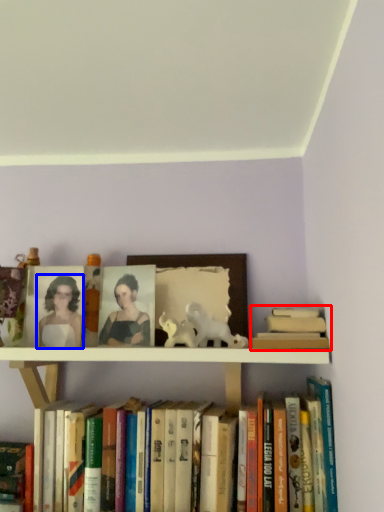
Question: Among these objects, which one is farthest to the camera, book (highlighted by a red box) or woman (highlighted by a blue box)?

Choices:
 (A) book
 (B) woman

Answer: (B)